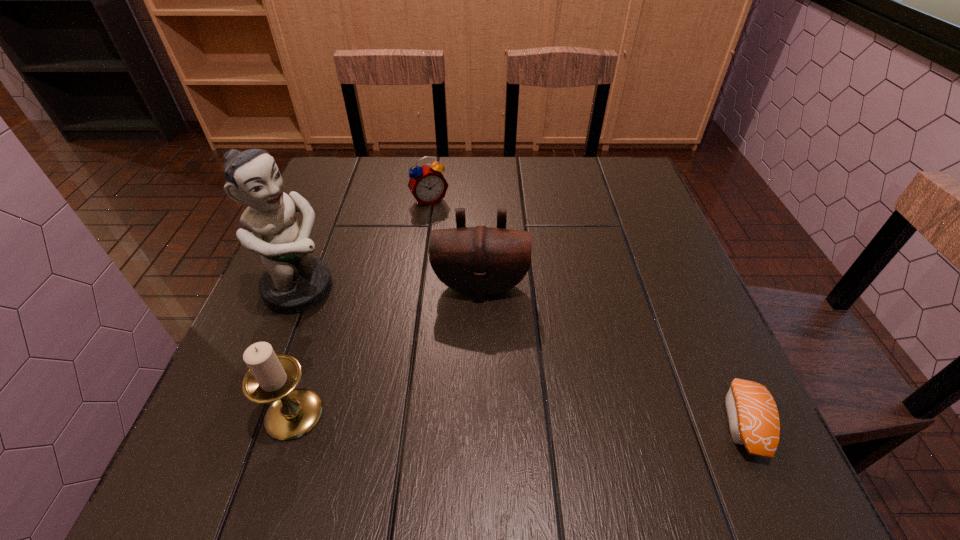
Where is `candle holder`? The width and height of the screenshot is (960, 540). candle holder is located at coordinates (272, 378).

I want to click on the rightmost object, so click(x=752, y=414).

Identify the location of the shortest object. pyautogui.click(x=752, y=414).

In order to click on alarm clock in this screenshot , I will do coord(427,184).

Identify the location of the fourth tallest object. This screenshot has height=540, width=960. (427, 184).

The image size is (960, 540). In order to click on pouch in this screenshot , I will do pyautogui.click(x=480, y=261).

The width and height of the screenshot is (960, 540). Find the location of `the tallest object`. the tallest object is located at coordinates (x=294, y=282).

What are the coordinates of `blank space located 0.210m on the back of the candle holder` in the screenshot? It's located at (330, 299).

Find the location of a particular element. vacant space located on the left of the rightmost object is located at coordinates (661, 423).

Find the location of a particular element. vacant area located 0.150m on the front-facing side of the alarm clock is located at coordinates (457, 244).